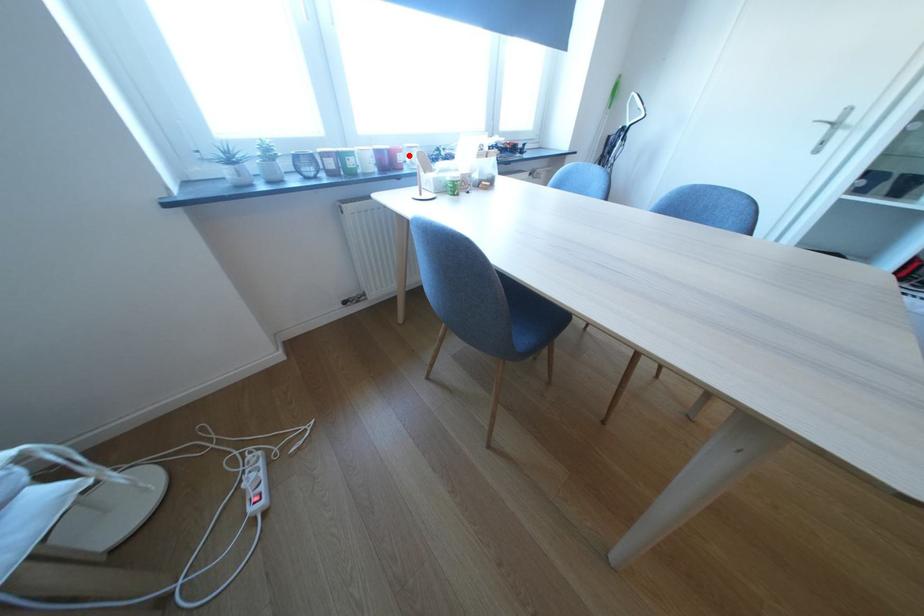
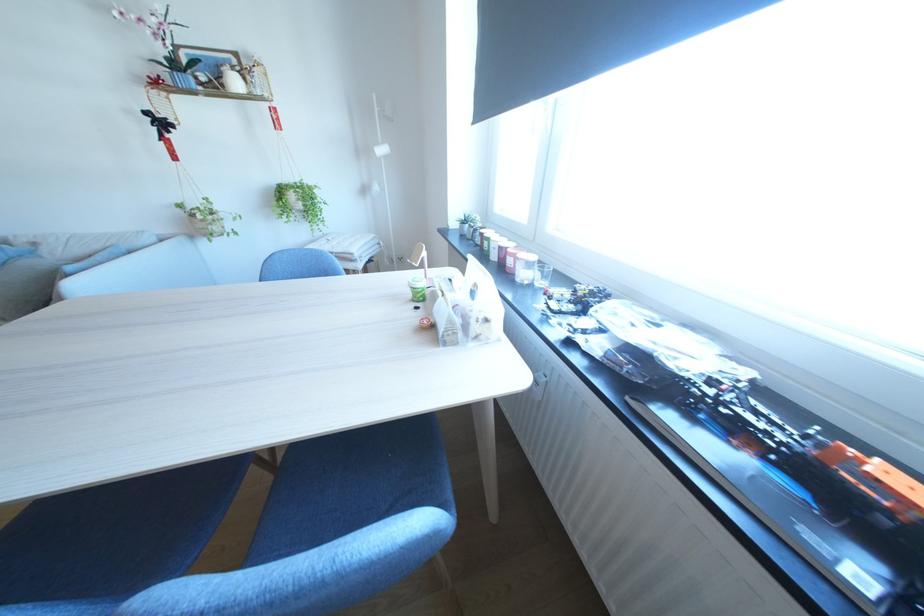
The point at the highlighted location is marked in the first image. Where is the corresponding point in the second image?

(518, 257)